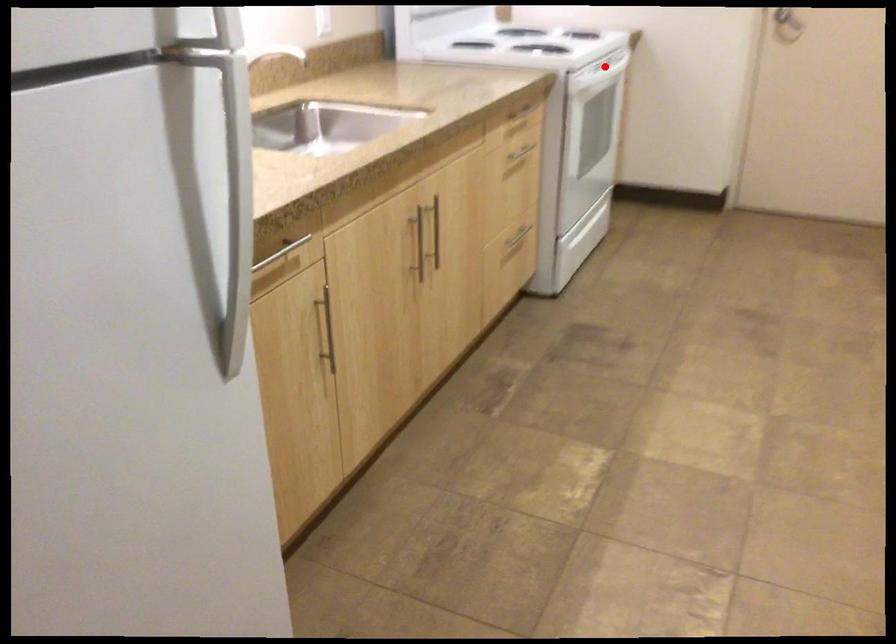
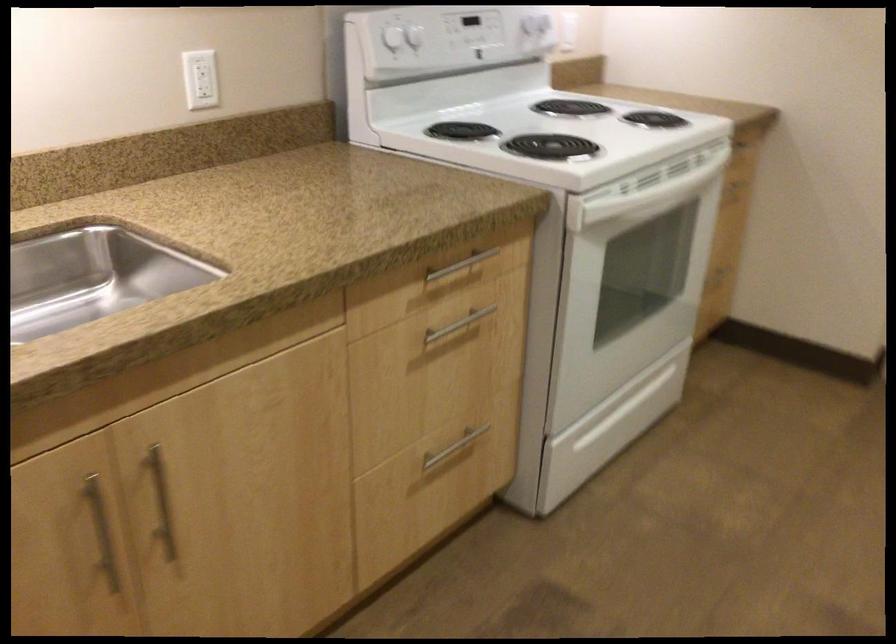
Question: I am providing you with two images of the same scene from different viewpoints. In image1, a red point is highlighted. Considering the same 3D point in image2, which of the following is correct?

Choices:
 (A) It is closer
 (B) It is farther

Answer: (A)